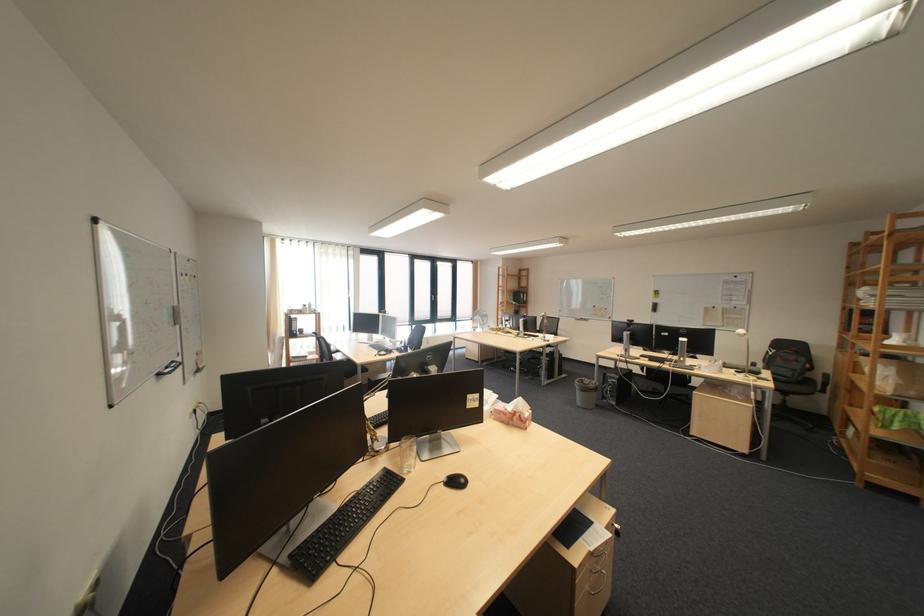
At what (x,y) coordinates should I click in order to perform the action: click on drawer lock. Please return your answer as a coordinate pair (x, y). Looking at the image, I should click on (601, 565).